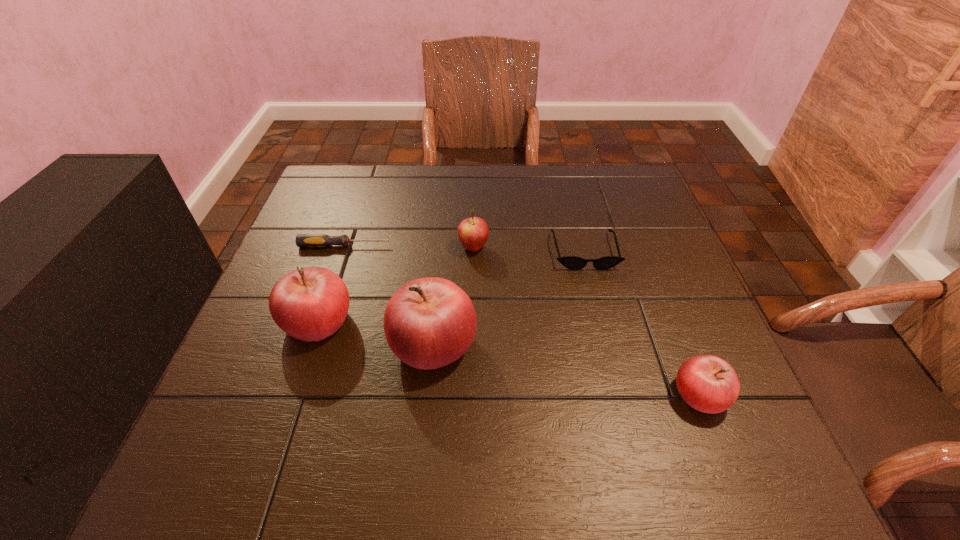
Locate an element on the screen. The height and width of the screenshot is (540, 960). vacant position for inserting another apple evenly is located at coordinates (561, 368).